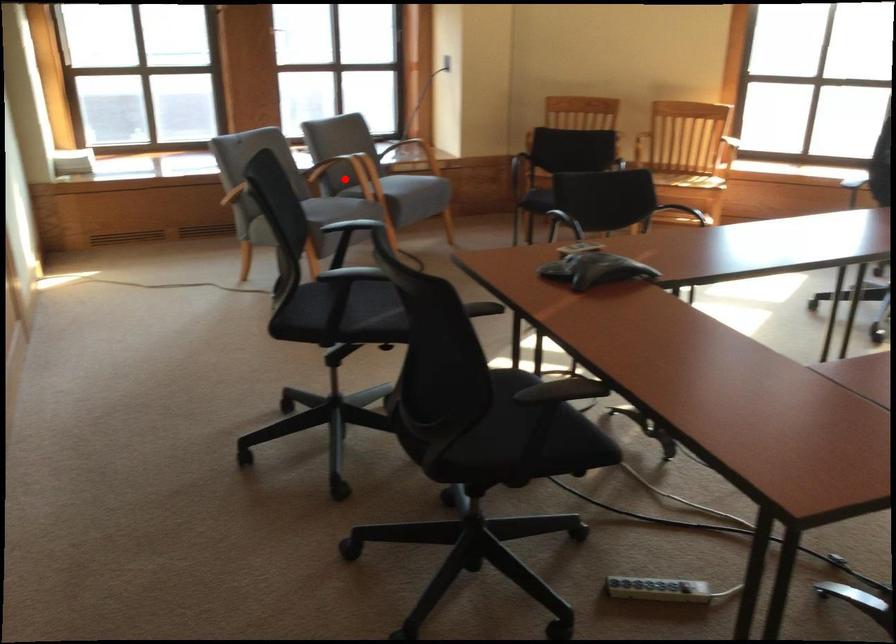
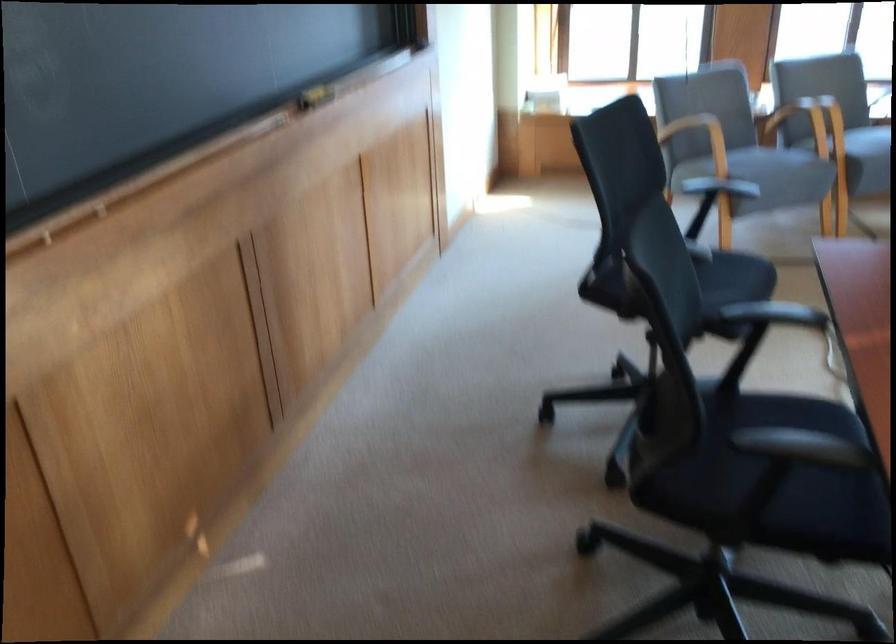
Question: I am providing you with two images of the same scene from different viewpoints. Image1 has a red point marked. In image2, the corresponding 3D location appears at what relative position? Reply with the corresponding letter.

Choices:
 (A) Closer
 (B) Farther

Answer: (A)